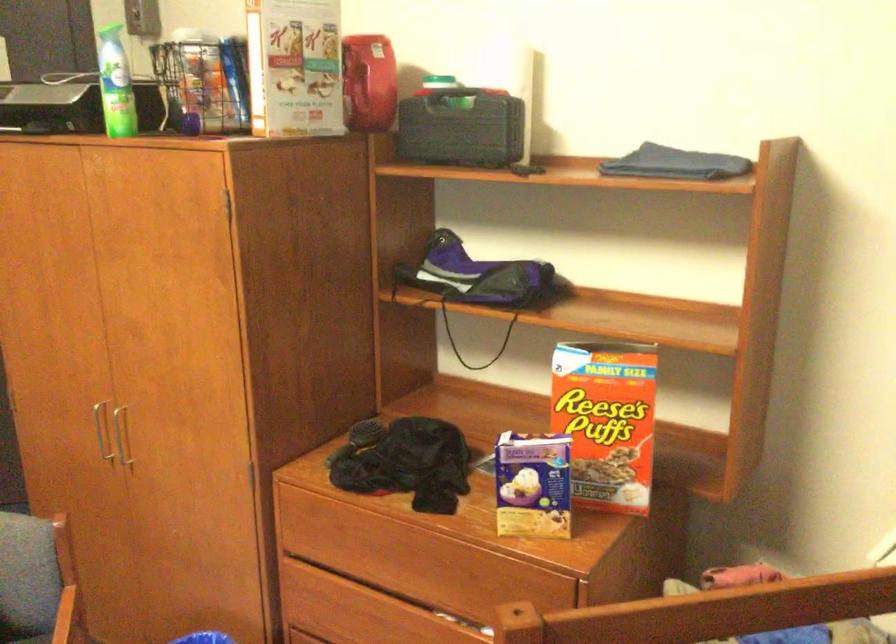
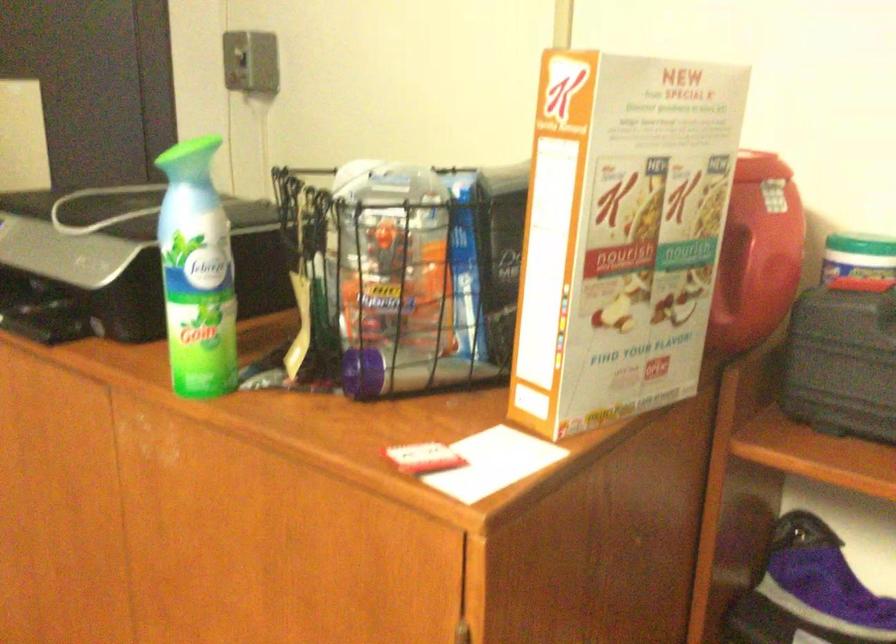
In a continuous first-person perspective shot, in which direction is the camera moving?

The cameraman moved toward left, forward.